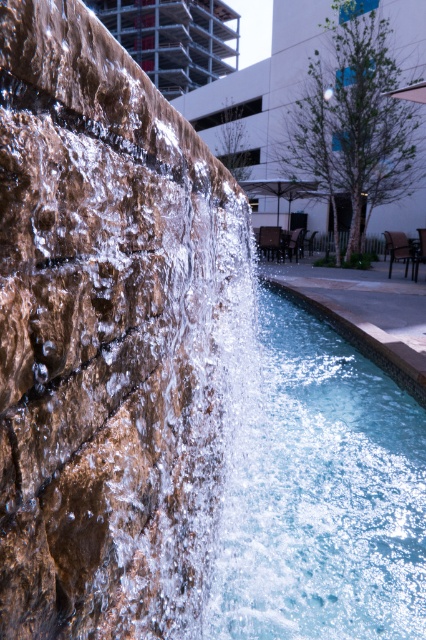
You are standing in the urban park and see the brown stone waterfall at left and the clear glass swimming pool at center. Which one is located to the right of the other?

The clear glass swimming pool at center is to the right of the brown stone waterfall at left.

Based on the photo, you are designing a new urban plaza and want to incorporate both the clear glass swimming pool at center and the smooth concrete wall at center. If you need to place a 1.5 meter wide sculpture between them, will there be enough space based on their dimensions?

The clear glass swimming pool at center is thinner than the smooth concrete wall at center, but without specific measurements for their widths, it is impossible to determine if there is enough space for the 1.5 meter wide sculpture between them.

You are standing at the center of the pool and want to locate the brown stone waterfall at left. In which direction should you look?

The brown stone waterfall at left is located to your left side, so you should look to your left.